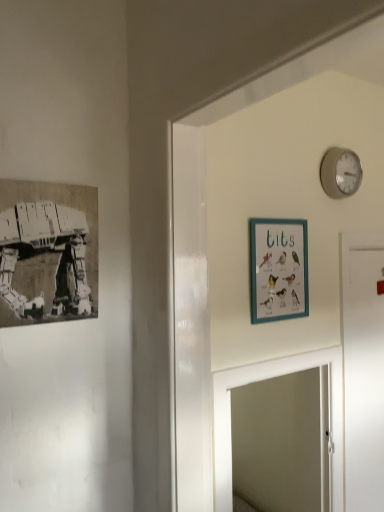
Find the location of `white matte wall clock at upper right`. white matte wall clock at upper right is located at coordinates (340, 172).

What is the approximate height of black paper print at left, acting as the 1th picture frame starting from the left?

42.53 centimeters.

Locate an element on the screen. Image resolution: width=384 pixels, height=512 pixels. teal wooden picture frame at upper center, marked as the first picture frame in a right-to-left arrangement is located at coordinates (278, 269).

This screenshot has width=384, height=512. I want to click on white matte wall clock at upper right, so click(x=340, y=172).

From the picture: From a real-world perspective, is white glossy mirror at center under white matte door at right?

Indeed, from a real-world perspective, white glossy mirror at center is positioned beneath white matte door at right.

From the image's perspective, is white glossy mirror at center beneath white matte door at right?

Yes, from the image's perspective, white glossy mirror at center is beneath white matte door at right.

Is white glossy mirror at center wider than white matte door at right?

Yes.

Where is `door behind the white glossy mirror at center`? door behind the white glossy mirror at center is located at coordinates (363, 370).

Are white matte wall clock at upper right and white glossy mirror at center located far from each other?

No, there isn't a large distance between white matte wall clock at upper right and white glossy mirror at center.

Which of these two, white matte wall clock at upper right or white glossy mirror at center, is bigger?

Bigger between the two is white glossy mirror at center.

Which is closer to the camera, (327, 167) or (331, 373)?

Point (327, 167)

Considering the sizes of objects white matte door at right and black paper print at left, which is the 2th picture frame in back-to-front order, in the image provided, who is wider, white matte door at right or black paper print at left, which is the 2th picture frame in back-to-front order,?

white matte door at right is wider.

Does white matte door at right appear on the right side of black paper print at left, the second picture frame positioned from the right?

Correct, you'll find white matte door at right to the right of black paper print at left, the second picture frame positioned from the right.

Which point is more forward, [360,287] or [16,180]?

The point [16,180] is closer to the camera.

Who is smaller, white matte door at right or black paper print at left, which is the 2th picture frame in back-to-front order?

With smaller size is black paper print at left, which is the 2th picture frame in back-to-front order.

Would you say teal wooden picture frame at upper center, marked as the first picture frame in a right-to-left arrangement, is part of white matte door at right's contents?

No, teal wooden picture frame at upper center, marked as the first picture frame in a right-to-left arrangement, is not surrounded by white matte door at right.

Is point (374, 490) closer or farther from the camera than point (290, 270)?

Point (374, 490).

Where is `the 1st picture frame positioned above the white matte door at right (from a real-world perspective)`? the 1st picture frame positioned above the white matte door at right (from a real-world perspective) is located at coordinates (278, 269).

Considering the relative sizes of white matte door at right and teal wooden picture frame at upper center, positioned as the 2th picture frame in left-to-right order, in the image provided, is white matte door at right wider than teal wooden picture frame at upper center, positioned as the 2th picture frame in left-to-right order,?

Yes.

What's the angular difference between teal wooden picture frame at upper center, acting as the 1th picture frame starting from the back, and white matte wall clock at upper right's facing directions?

→ The angle between the facing direction of teal wooden picture frame at upper center, acting as the 1th picture frame starting from the back, and the facing direction of white matte wall clock at upper right is 0.236 degrees.

In the scene shown: Is white matte wall clock at upper right surrounded by teal wooden picture frame at upper center, acting as the 1th picture frame starting from the back?

No, white matte wall clock at upper right is located outside of teal wooden picture frame at upper center, acting as the 1th picture frame starting from the back.

Visually, is teal wooden picture frame at upper center, marked as the first picture frame in a right-to-left arrangement, positioned to the left or to the right of white matte wall clock at upper right?

From the image, it's evident that teal wooden picture frame at upper center, marked as the first picture frame in a right-to-left arrangement, is to the left of white matte wall clock at upper right.

Consider the image. Which is in front, white matte door at right or white glossy mirror at center?

white glossy mirror at center is in front.

What's the angular difference between white matte door at right and white glossy mirror at center's facing directions?

3.97e-05 degrees.

From a real-world perspective, relative to white glossy mirror at center, is white matte door at right vertically above or below?

From a real-world perspective, white matte door at right is physically above white glossy mirror at center.

Does white matte door at right come in front of white matte wall clock at upper right?

No, the depth of white matte door at right is greater than that of white matte wall clock at upper right.

From the image's perspective, is white matte door at right above or below white matte wall clock at upper right?

white matte door at right is below white matte wall clock at upper right.

From a real-world perspective, which object rests below the other?

From a 3D spatial view, white matte door at right is below.

Considering the sizes of white matte door at right and white matte wall clock at upper right in the image, is white matte door at right wider or thinner than white matte wall clock at upper right?

Considering their sizes, white matte door at right looks slimmer than white matte wall clock at upper right.

At what (x,y) coordinates should I click in order to perform the action: click on door above the white glossy mirror at center (from a real-world perspective). Please return your answer as a coordinate pair (x, y). Looking at the image, I should click on (363, 370).

Where is `wall clock on the right side of white glossy mirror at center`? This screenshot has height=512, width=384. wall clock on the right side of white glossy mirror at center is located at coordinates (340, 172).

Which object lies nearer to the anchor point white matte door at right, white glossy mirror at center or teal wooden picture frame at upper center, positioned as the 2th picture frame in left-to-right order?

white glossy mirror at center lies closer to white matte door at right than the other object.

Based on their spatial positions, is white matte wall clock at upper right or white glossy mirror at center closer to white matte door at right?

white glossy mirror at center is positioned closer to the anchor white matte door at right.

Estimate the real-world distances between objects in this image. Which object is closer to white matte door at right, white matte wall clock at upper right or black paper print at left, which is the 2th picture frame in back-to-front order?

white matte wall clock at upper right lies closer to white matte door at right than the other object.

From the image, which object appears to be farther from white matte wall clock at upper right, teal wooden picture frame at upper center, which is counted as the second picture frame, starting from the front, or white glossy mirror at center?

Among the two, white glossy mirror at center is located further to white matte wall clock at upper right.

Considering their positions, is teal wooden picture frame at upper center, marked as the first picture frame in a right-to-left arrangement, positioned closer to black paper print at left, which is the 2th picture frame in back-to-front order, than white matte door at right?

teal wooden picture frame at upper center, marked as the first picture frame in a right-to-left arrangement, is positioned closer to the anchor black paper print at left, which is the 2th picture frame in back-to-front order.

When comparing their distances from teal wooden picture frame at upper center, positioned as the 2th picture frame in left-to-right order, does white matte door at right or white matte wall clock at upper right seem further?

The object further to teal wooden picture frame at upper center, positioned as the 2th picture frame in left-to-right order, is white matte door at right.

From the picture: When comparing their distances from white matte wall clock at upper right, does white glossy mirror at center or white matte door at right seem further?

white glossy mirror at center.

Looking at the image, which one is located closer to white glossy mirror at center, white matte wall clock at upper right or white matte door at right?

The object closer to white glossy mirror at center is white matte door at right.

Identify the location of wall clock between black paper print at left, which is counted as the 1th picture frame, starting from the front, and white matte door at right from left to right. The image size is (384, 512). (340, 172).

At what (x,y) coordinates should I click in order to perform the action: click on picture frame situated between black paper print at left, which is counted as the 1th picture frame, starting from the front, and white matte door at right from left to right. Please return your answer as a coordinate pair (x, y). Image resolution: width=384 pixels, height=512 pixels. Looking at the image, I should click on (278, 269).

The image size is (384, 512). Identify the location of door between white matte wall clock at upper right and white glossy mirror at center vertically. (363, 370).

I want to click on mirror between black paper print at left, the second picture frame positioned from the right, and white matte door at right, so click(x=265, y=379).